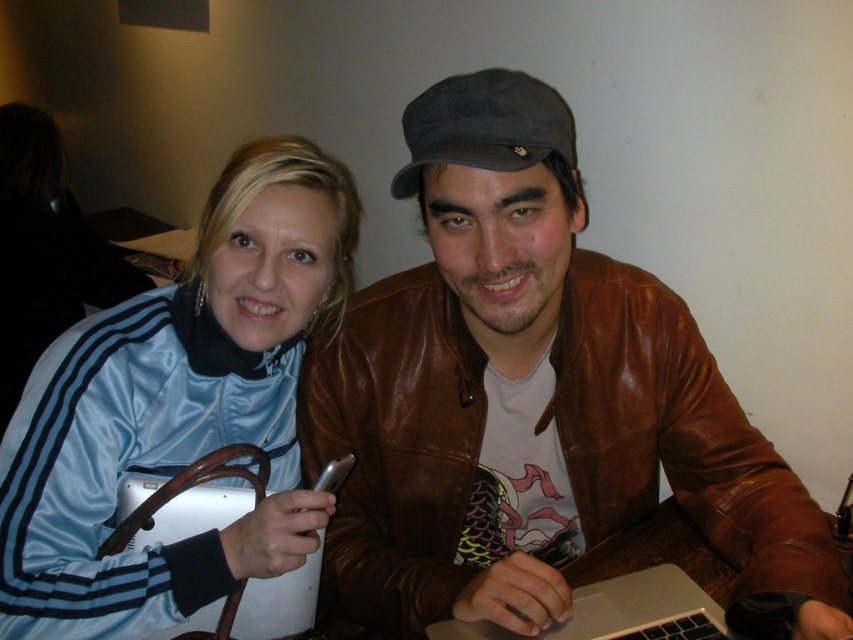
Is point (631, 413) farther from viewer compared to point (704, 616)?

Yes.

Between brown leather jacket at center and silver metallic laptop at center, which one is positioned lower?

Positioned lower is silver metallic laptop at center.

Is point (550, 438) positioned after point (654, 579)?

Yes, point (550, 438) is behind point (654, 579).

At what (x,y) coordinates should I click in order to perform the action: click on brown leather jacket at center. Please return your answer as a coordinate pair (x, y). The height and width of the screenshot is (640, 853). Looking at the image, I should click on (532, 403).

Which is behind, point (231, 378) or point (625, 584)?

Positioned behind is point (231, 378).

Between point (306, 188) and point (697, 625), which one is positioned in front?

Point (697, 625) is in front.

Describe the element at coordinates (178, 408) in the screenshot. I see `satin blue jacket at upper left` at that location.

Locate an element on the screen. satin blue jacket at upper left is located at coordinates (178, 408).

Who is more forward, [485,113] or [163,536]?

Point [485,113] is in front.

Is brown leather jacket at center positioned in front of white matte laptop at center?

Yes, brown leather jacket at center is closer to the viewer.

Who is more distant from viewer, (827, 608) or (277, 596)?

Point (277, 596)

I want to click on brown leather jacket at center, so click(532, 403).